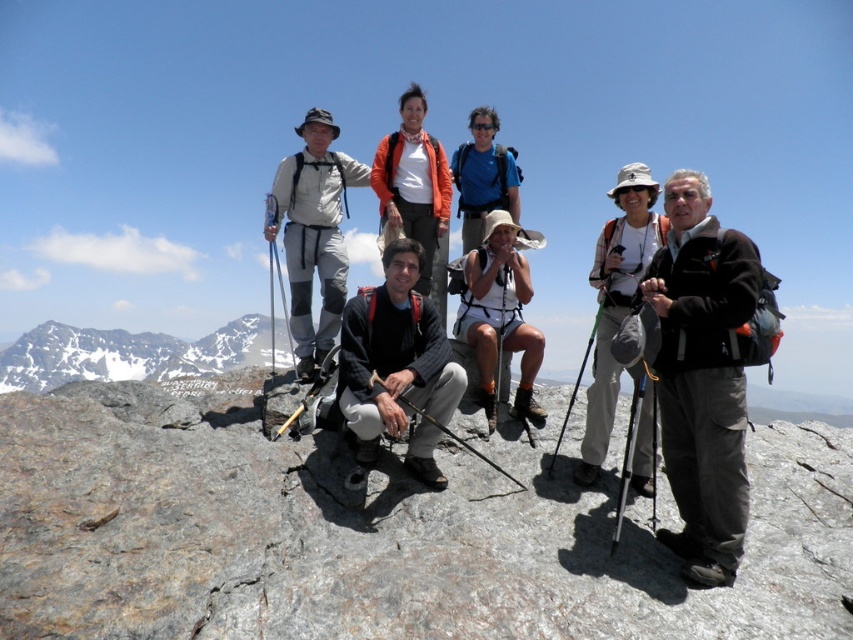
Question: Which point is farther to the camera?

Choices:
 (A) (323, 145)
 (B) (672, 288)

Answer: (A)

Question: Is snowy granite mountain at left further to camera compared to blue fabric backpack at center?

Choices:
 (A) yes
 (B) no

Answer: (B)

Question: Is white fabric shorts at center further to the viewer compared to blue fabric backpack at center?

Choices:
 (A) no
 (B) yes

Answer: (A)

Question: Which object is positioned closest to the black wool sweater at center?

Choices:
 (A) white fabric shorts at center
 (B) matte orange jacket at center

Answer: (A)

Question: Can you confirm if gray rock at center is wider than white fabric shorts at center?

Choices:
 (A) yes
 (B) no

Answer: (A)

Question: Which point appears closest to the camera in this image?

Choices:
 (A) (315, 160)
 (B) (338, 541)
 (C) (642, 284)
 (D) (131, 356)

Answer: (B)